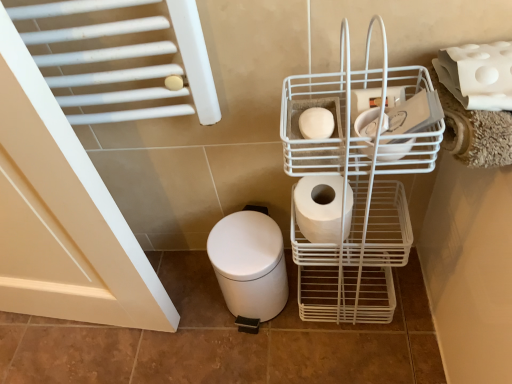
The width and height of the screenshot is (512, 384). Find the location of `vacant area that is in front of white matte toilet bowl at lower left`. vacant area that is in front of white matte toilet bowl at lower left is located at coordinates (273, 361).